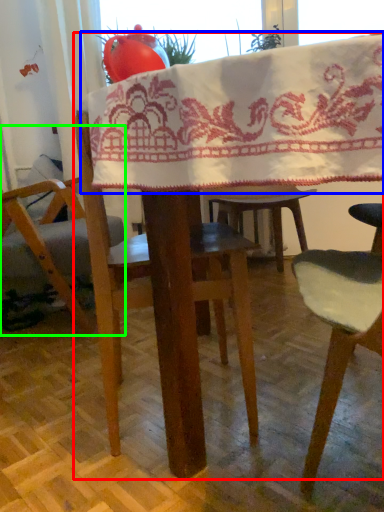
Question: Which is farther away from table (highlighted by a red box)? blanket (highlighted by a blue box) or chair (highlighted by a green box)?

Choices:
 (A) blanket
 (B) chair

Answer: (B)